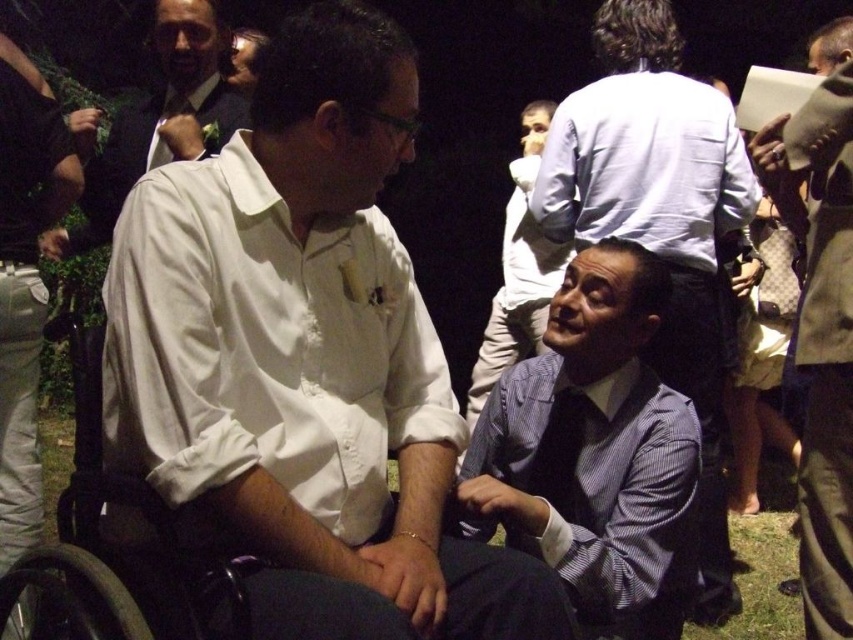
Question: Which object is farther from the camera taking this photo?

Choices:
 (A) white matte shirt at center
 (B) striped fabric shirt at center
 (C) white satin tie at upper left
 (D) striped fabric shirt at lower center

Answer: (C)

Question: Observing the image, what is the correct spatial positioning of striped fabric shirt at lower center in reference to black plastic wheelchair at left?

Choices:
 (A) below
 (B) above

Answer: (B)

Question: Estimate the real-world distances between objects in this image. Which object is farther from the light brown leather jacket at upper right?

Choices:
 (A) white satin tie at upper left
 (B) black plastic wheelchair at left

Answer: (A)

Question: Which is farther from the striped fabric shirt at center?

Choices:
 (A) black plastic wheelchair at left
 (B) white satin tie at upper left
 (C) light blue striped shirt at center
 (D) light brown leather jacket at upper right

Answer: (A)

Question: Can you confirm if white matte shirt at center is positioned below black plastic wheelchair at left?

Choices:
 (A) no
 (B) yes

Answer: (A)

Question: Is light brown leather jacket at upper right behind white satin tie at upper left?

Choices:
 (A) no
 (B) yes

Answer: (A)